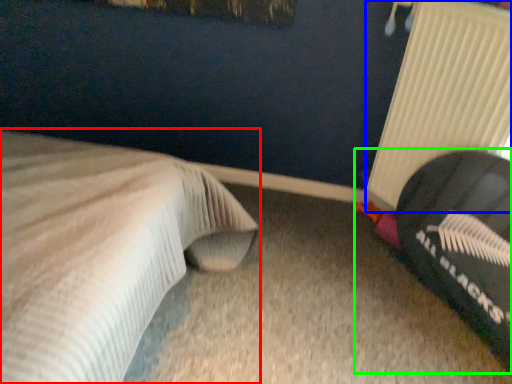
Question: Estimate the real-world distances between objects in this image. Which object is farther from bed (highlighted by a red box), radiator (highlighted by a blue box) or bean bag chair (highlighted by a green box)?

Choices:
 (A) radiator
 (B) bean bag chair

Answer: (A)